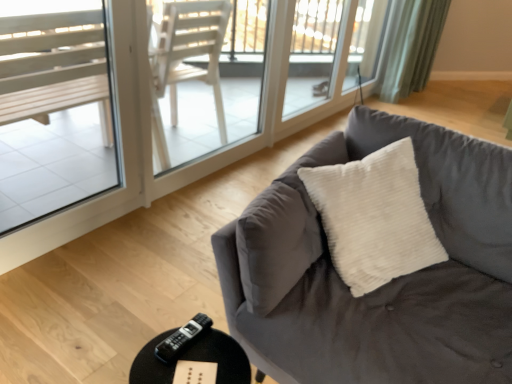
The height and width of the screenshot is (384, 512). Identify the location of vacant space underneath white wood screen door at upper center, the first screen door viewed from the front (from a real-world perspective). (211, 168).